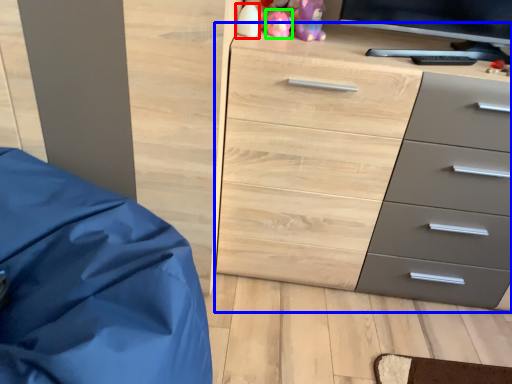
Question: Estimate the real-world distances between objects in this image. Which object is farther from toy (highlighted by a red box), chest of drawers (highlighted by a blue box) or toy (highlighted by a green box)?

Choices:
 (A) chest of drawers
 (B) toy

Answer: (A)